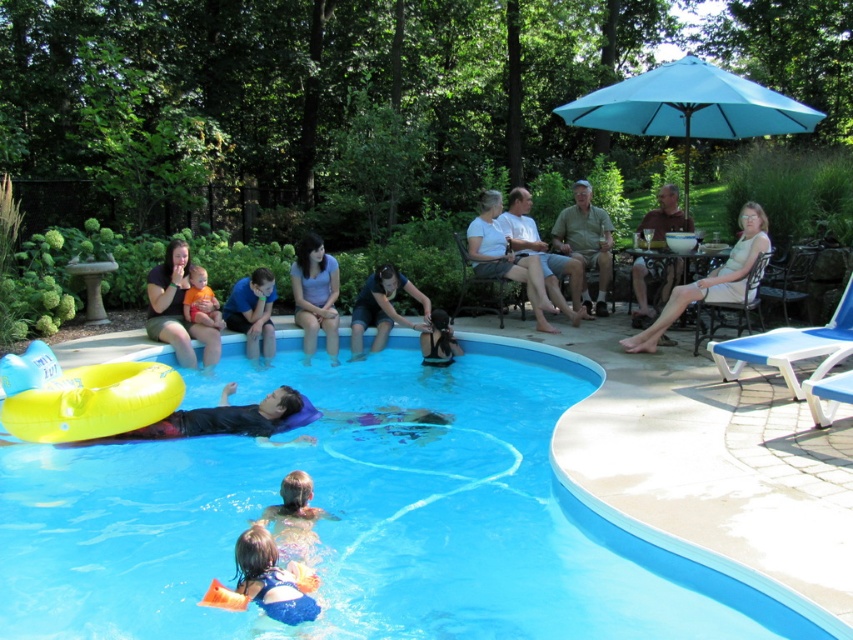
Question: Which point is farther from the camera taking this photo?

Choices:
 (A) (323, 296)
 (B) (204, 310)

Answer: (A)

Question: Does matte blue shorts at upper left appear on the left side of brown fabric chair at upper right?

Choices:
 (A) no
 (B) yes

Answer: (B)

Question: Can you confirm if light brown wood chair at center is wider than brown fabric chair at upper right?

Choices:
 (A) no
 (B) yes

Answer: (B)

Question: Which point is farther to the camera?

Choices:
 (A) (282, 545)
 (B) (688, 72)

Answer: (B)

Question: Is blue smooth water at center to the left of matte blue shorts at upper left from the viewer's perspective?

Choices:
 (A) no
 (B) yes

Answer: (A)

Question: Among these points, which one is farthest from the camera?

Choices:
 (A) (646, 269)
 (B) (294, 502)

Answer: (A)